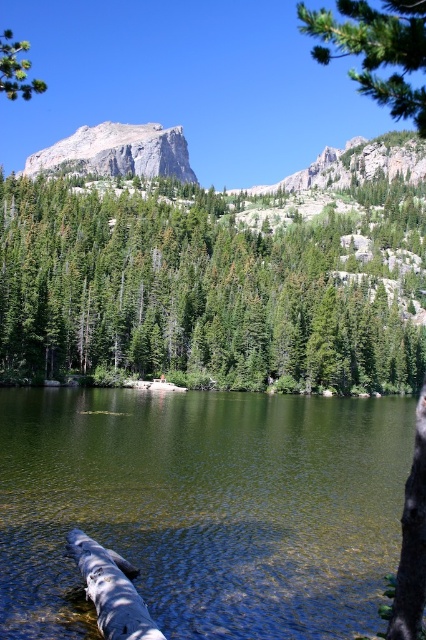
You are a hiker who wants to cross the lake using the smooth gray log at lower left. However, you notice a green textured pine tree at upper right that might block your path. Is the pine tree close enough to interfere with your crossing?

The green textured pine tree at upper right and smooth gray log at lower left are 37.36 meters apart, so the pine tree is not close enough to interfere with your crossing of the lake using the smooth gray log at lower left.

You are an environmental scientist assessing the lake ecosystem. You observe the smooth gray log at lower left and the green leafy tree at upper left. Which object is closer to the water surface?

The smooth gray log at lower left is positioned under the green leafy tree at upper left, so it is closer to the water surface.

You are a hiker standing at the edge of the lake and want to take a photo of both the green textured pine tree at upper right and the smooth gray log at lower left. Which object should you focus on first if you want to capture both in one frame without moving your camera?

You should focus on the green textured pine tree at upper right first because it is much taller than the smooth gray log at lower left, so adjusting the camera angle to include its height will naturally include the log in the foreground.